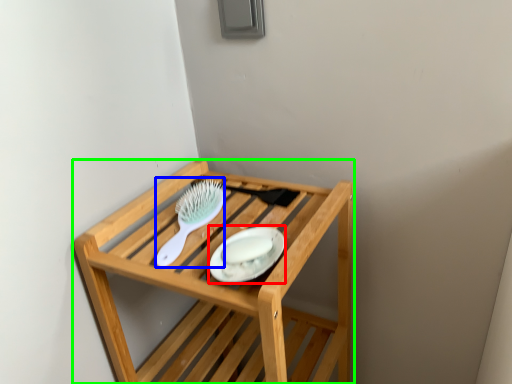
Question: Which object is positioned farthest from platter (highlighted by a red box)? Select from brush (highlighted by a blue box) and furniture (highlighted by a green box).

Choices:
 (A) brush
 (B) furniture

Answer: (B)